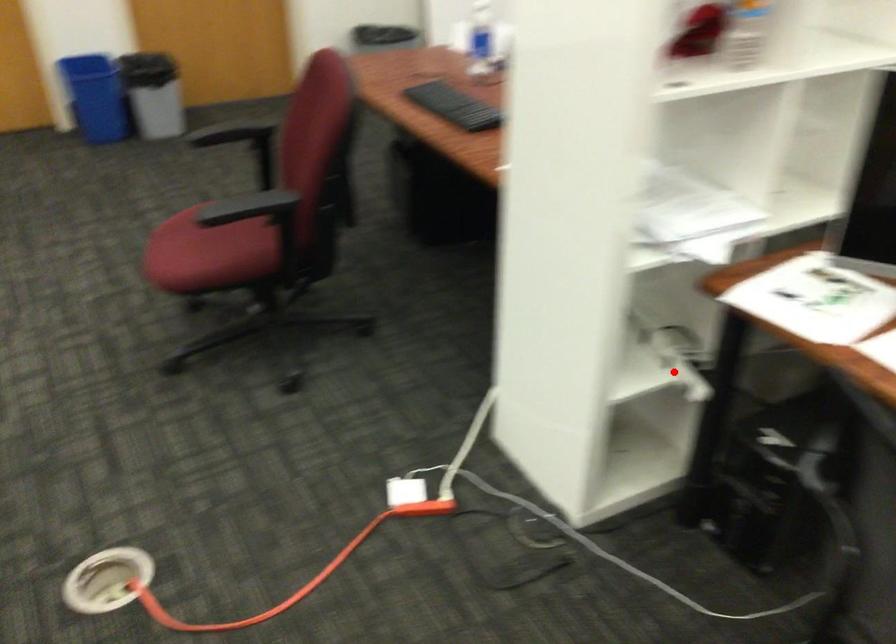
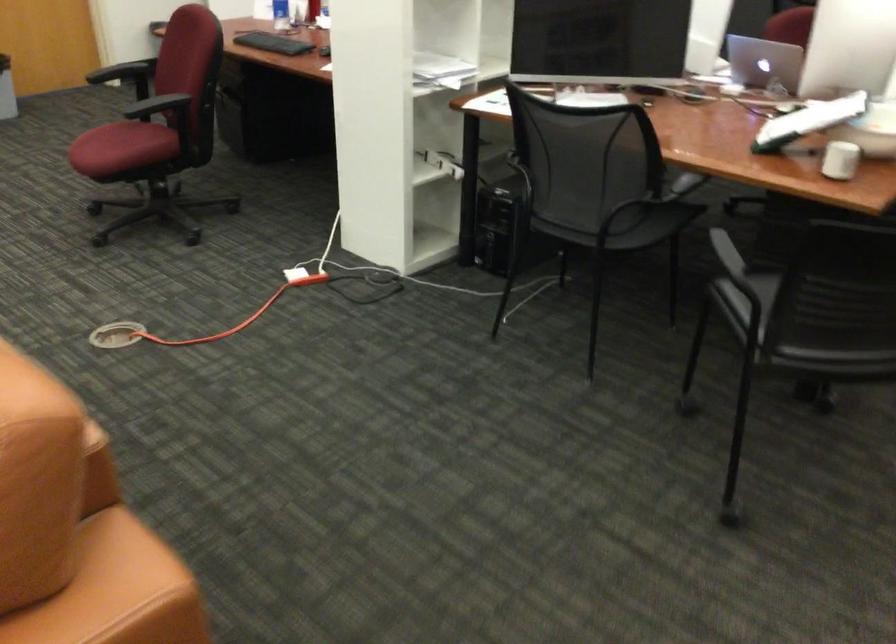
Question: I am providing you with two images of the same scene from different viewpoints. A red point is marked on the first image. Can you still see the location of the red point in image 2?

Choices:
 (A) Yes
 (B) No

Answer: (A)